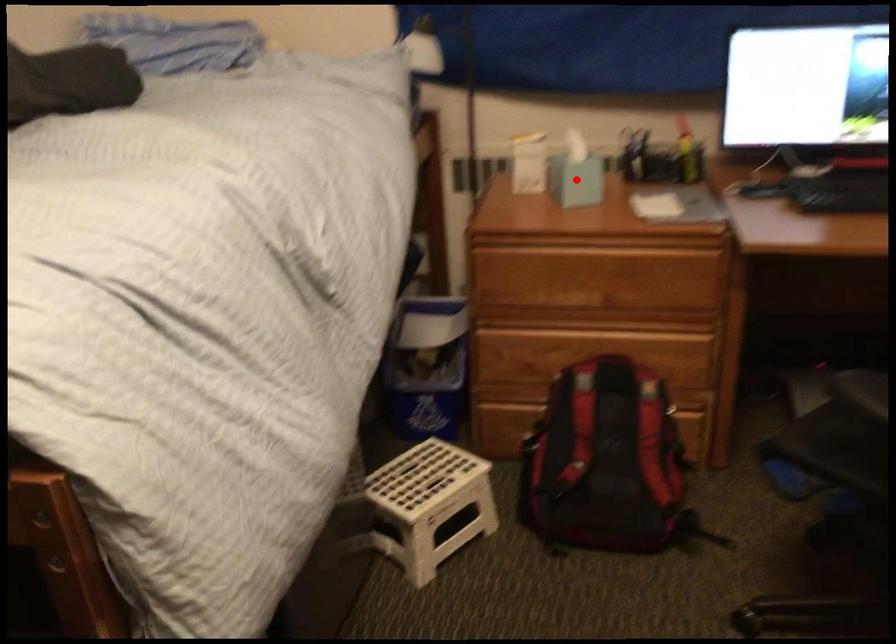
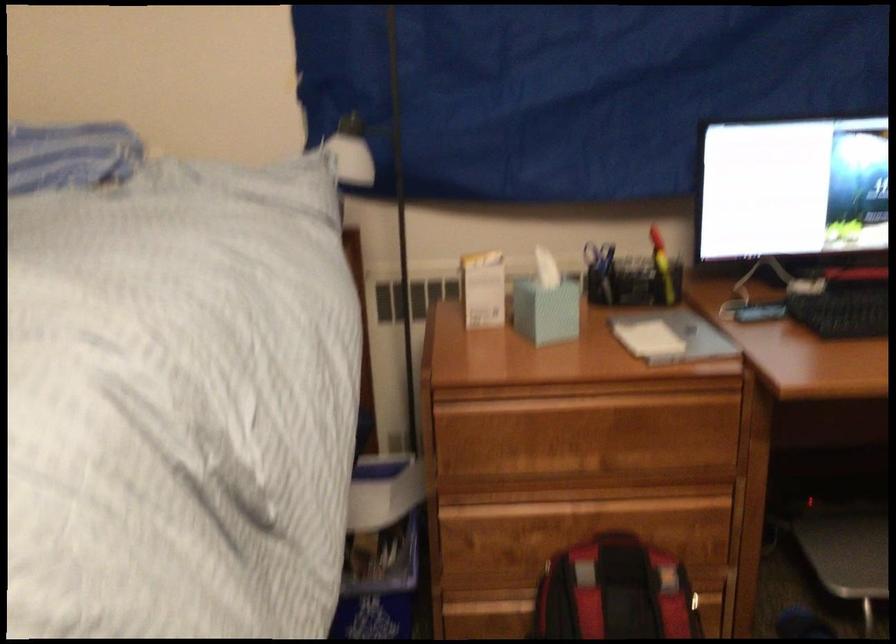
Where in the second image is the point corresponding to the highlighted location from the first image?

(546, 310)